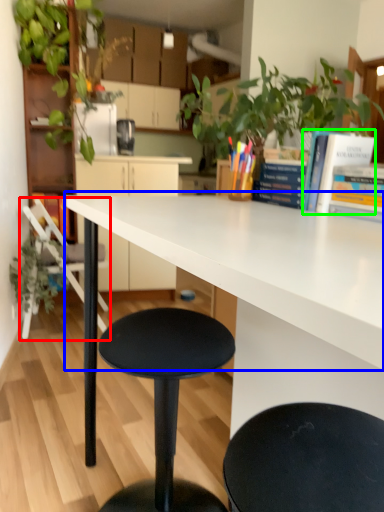
Question: Which object is the farthest from chair (highlighted by a red box)? Choose among these: countertop (highlighted by a blue box) or book (highlighted by a green box).

Choices:
 (A) countertop
 (B) book

Answer: (B)